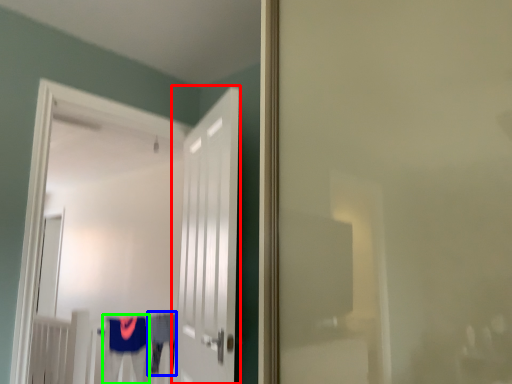
Question: Estimate the real-world distances between objects in this image. Which object is closer to door (highlighted by a red box), robe (highlighted by a blue box) or robe (highlighted by a green box)?

Choices:
 (A) robe
 (B) robe

Answer: (B)